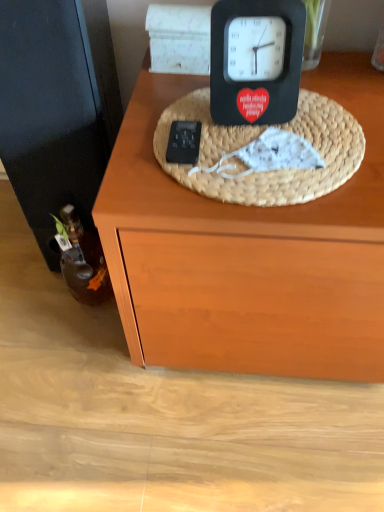
At what (x,y) coordinates should I click in order to perform the action: click on vacant space to the left of black matte clock at upper center. Please return your answer as a coordinate pair (x, y). The image size is (384, 512). Looking at the image, I should click on (172, 110).